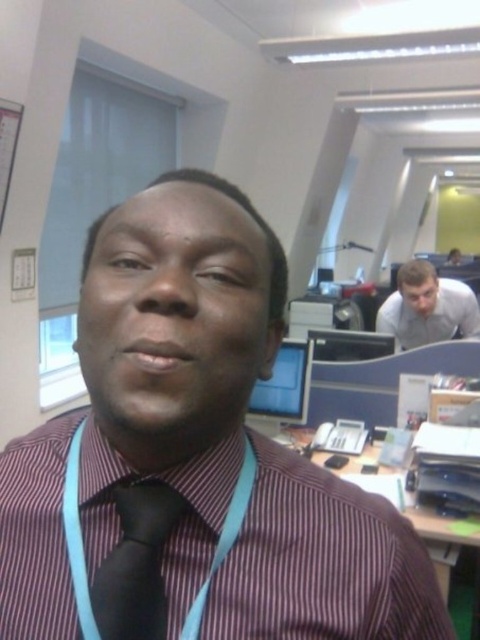
Question: Does maroon striped shirt at center appear over wooden desk at center?

Choices:
 (A) yes
 (B) no

Answer: (A)

Question: Does black satin tie at center lie in front of white glossy shirt at upper right?

Choices:
 (A) no
 (B) yes

Answer: (B)

Question: Among these points, which one is nearest to the camera?

Choices:
 (A) pos(266,424)
 (B) pos(112,612)
 (C) pos(433,285)

Answer: (B)

Question: Which of the following is the farthest from the observer?

Choices:
 (A) click(x=255, y=392)
 (B) click(x=57, y=621)
 (C) click(x=299, y=442)

Answer: (C)

Question: Which of the following is the farthest from the observer?

Choices:
 (A) maroon striped shirt at center
 (B) white glossy shirt at upper right

Answer: (B)

Question: Is striped cotton shirt at center positioned behind black satin tie at center?

Choices:
 (A) yes
 (B) no

Answer: (A)